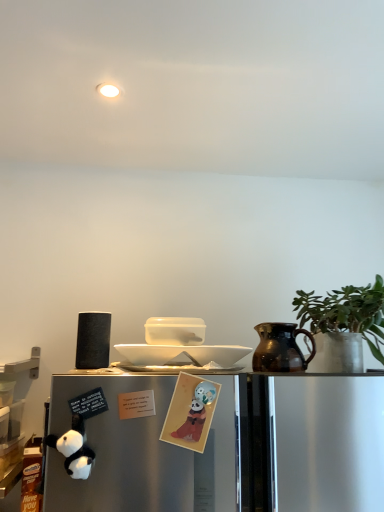
Question: Is white glossy plate at center to the right of green matte plant at right from the viewer's perspective?

Choices:
 (A) no
 (B) yes

Answer: (A)

Question: From a real-world perspective, is white glossy plate at center beneath green matte plant at right?

Choices:
 (A) no
 (B) yes

Answer: (B)

Question: Does white glossy plate at center have a larger size compared to green matte plant at right?

Choices:
 (A) yes
 (B) no

Answer: (B)

Question: Does white glossy plate at center have a lesser width compared to green matte plant at right?

Choices:
 (A) no
 (B) yes

Answer: (B)

Question: Considering the relative sizes of white glossy plate at center and green matte plant at right in the image provided, is white glossy plate at center taller than green matte plant at right?

Choices:
 (A) yes
 (B) no

Answer: (B)

Question: Is point (203, 395) closer or farther from the camera than point (306, 362)?

Choices:
 (A) closer
 (B) farther

Answer: (A)

Question: Considering the relative positions of matte paper card at center, which appears as the first toy when viewed from the right, and brown glazed jug at right in the image provided, is matte paper card at center, which appears as the first toy when viewed from the right, to the left or to the right of brown glazed jug at right?

Choices:
 (A) left
 (B) right

Answer: (A)

Question: Looking at the image, does matte paper card at center, which appears as the first toy when viewed from the right, seem bigger or smaller compared to brown glazed jug at right?

Choices:
 (A) small
 (B) big

Answer: (A)

Question: From the image's perspective, is matte paper card at center, which is the 2th toy from left to right, positioned above or below brown glazed jug at right?

Choices:
 (A) below
 (B) above

Answer: (A)

Question: Is white plush panda at lower left, the 2th toy when ordered from right to left, inside or outside of green matte plant at right?

Choices:
 (A) inside
 (B) outside

Answer: (B)

Question: Is white plush panda at lower left, which is counted as the first toy, starting from the left, taller or shorter than green matte plant at right?

Choices:
 (A) short
 (B) tall

Answer: (A)

Question: Would you say white plush panda at lower left, the 2th toy when ordered from right to left, is to the left or to the right of green matte plant at right in the picture?

Choices:
 (A) left
 (B) right

Answer: (A)

Question: Relative to green matte plant at right, is white plush panda at lower left, which is counted as the first toy, starting from the left, in front or behind?

Choices:
 (A) front
 (B) behind

Answer: (A)

Question: Choose the correct answer: Is matte paper card at center, which appears as the first toy when viewed from the right, inside white glossy plate at center or outside it?

Choices:
 (A) inside
 (B) outside

Answer: (B)

Question: Considering the positions of point (195, 419) and point (226, 355), is point (195, 419) closer or farther from the camera than point (226, 355)?

Choices:
 (A) closer
 (B) farther

Answer: (A)